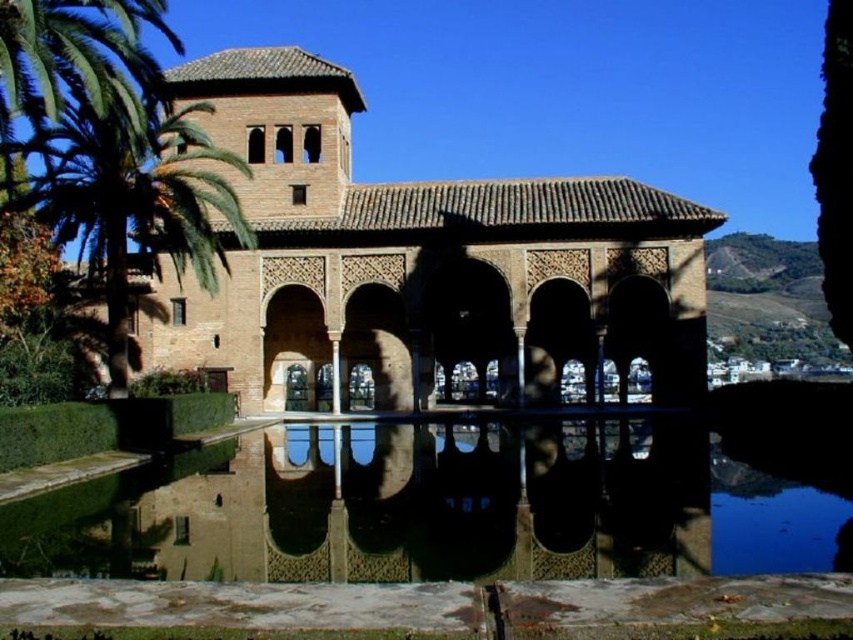
Question: Does clear glass water at center have a greater width compared to green leafy palm tree at upper left?

Choices:
 (A) no
 (B) yes

Answer: (B)

Question: Which point appears farthest from the camera in this image?

Choices:
 (A) (196, 524)
 (B) (135, 176)

Answer: (B)

Question: Does clear glass water at center appear on the right side of green leafy palm tree at upper left?

Choices:
 (A) yes
 (B) no

Answer: (A)

Question: Which of the following is the closest to the observer?

Choices:
 (A) clear glass water at center
 (B) green leafy palm tree at upper left

Answer: (A)

Question: Is clear glass water at center wider than green leafy palm tree at upper left?

Choices:
 (A) no
 (B) yes

Answer: (B)